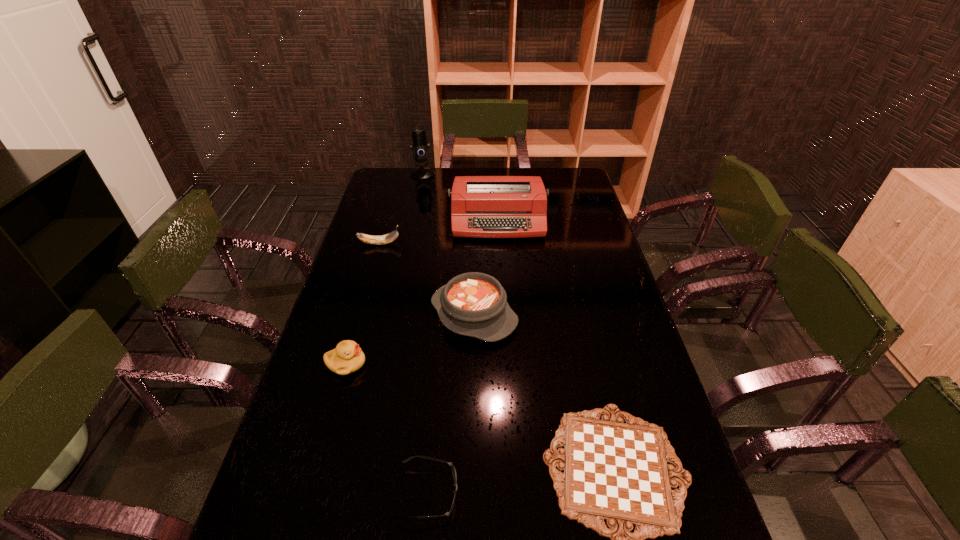
The image size is (960, 540). Find the location of `free space located at the stem of the banana`. free space located at the stem of the banana is located at coordinates (464, 244).

This screenshot has width=960, height=540. What are the coordinates of `free region located at the beak of the fifth farthest object` in the screenshot? It's located at (x=410, y=364).

Locate an element on the screen. The width and height of the screenshot is (960, 540). vacant position located on the lenses of the sunglasses is located at coordinates (500, 493).

Identify the location of object that is at the far edge. This screenshot has width=960, height=540. (420, 146).

Where is `microphone that is at the left edge`? microphone that is at the left edge is located at coordinates (420, 146).

In order to click on banana that is at the left edge in this screenshot , I will do `click(388, 238)`.

Locate an element on the screen. duckling present at the left edge is located at coordinates (347, 357).

Find the location of a particular element. object at the far left corner is located at coordinates [420, 146].

The width and height of the screenshot is (960, 540). In order to click on blank space at the far edge of the desktop in this screenshot , I will do 492,170.

Where is `vacant space at the left edge of the desktop`? Image resolution: width=960 pixels, height=540 pixels. vacant space at the left edge of the desktop is located at coordinates (333, 400).